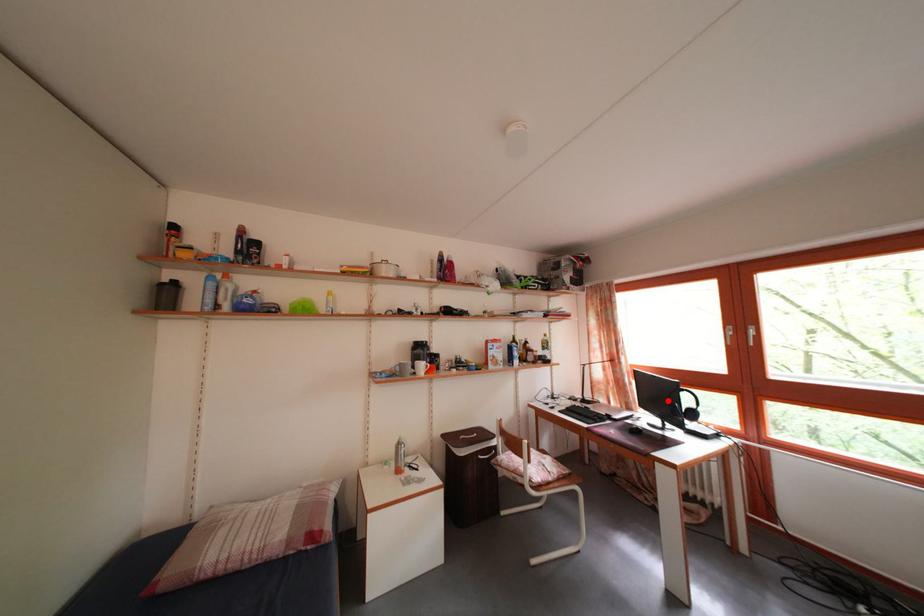
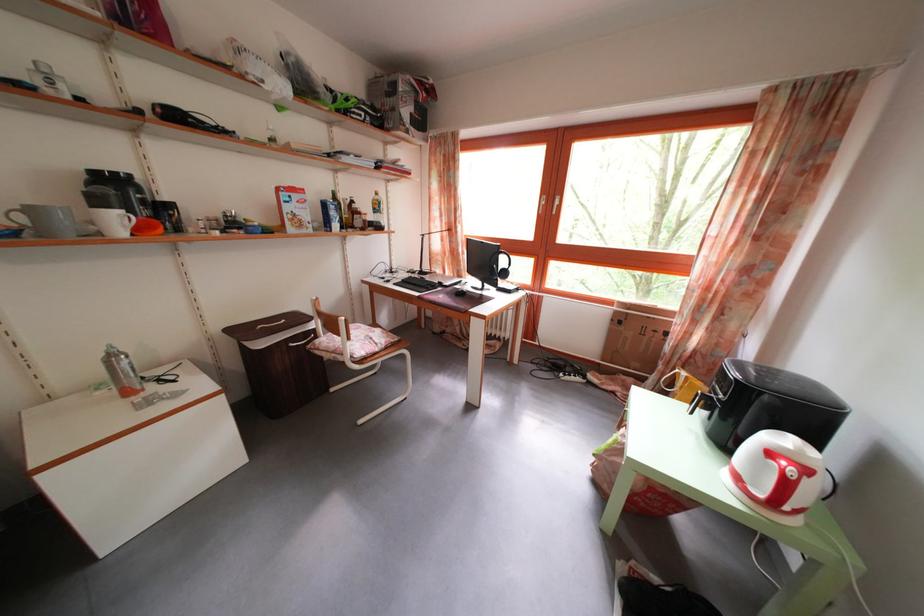
Find the pixel in the second image that matches the highlighted location in the first image.

(492, 265)